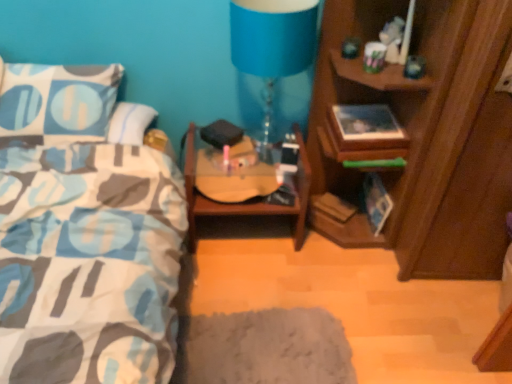
Identify the location of vacant region in front of wooden guitar case at center. (251, 288).